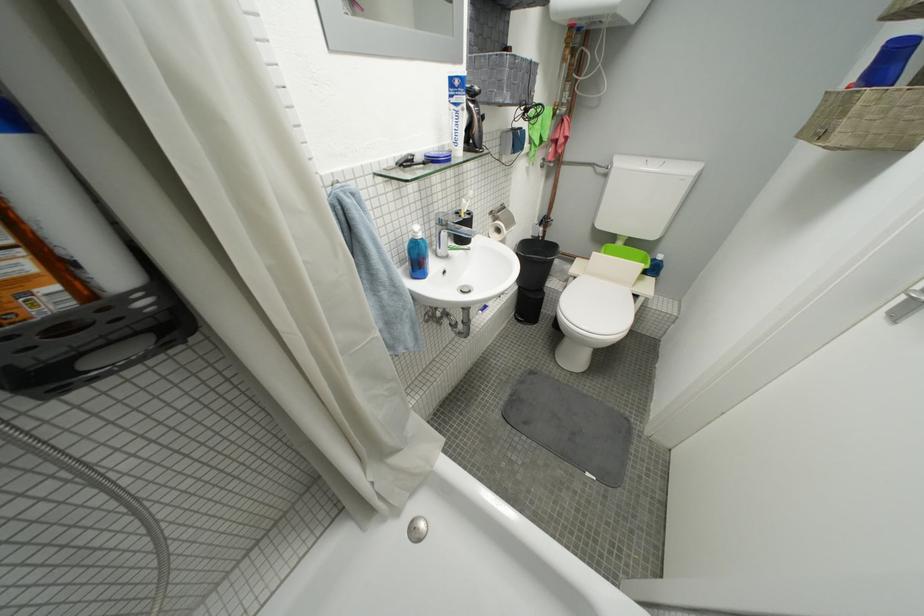
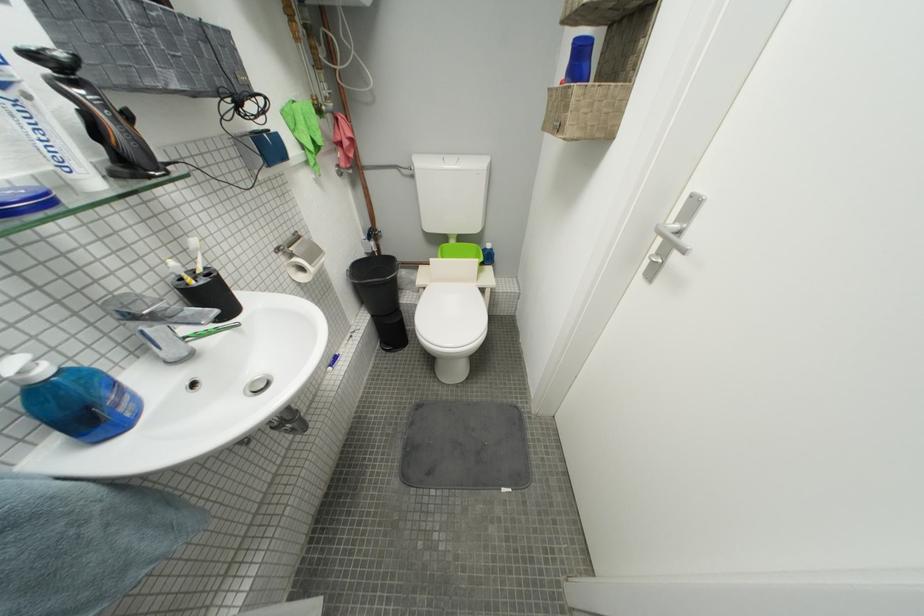
The point at (429, 238) is marked in the first image. Where is the corresponding point in the second image?

(53, 374)